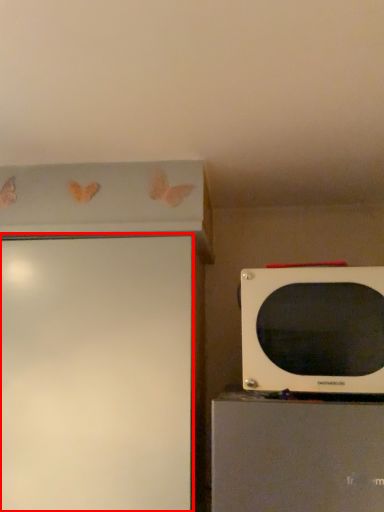
Question: From the image's perspective, where is screen door (annotated by the red box) located in relation to microwave oven in the image?

Choices:
 (A) above
 (B) below

Answer: (B)